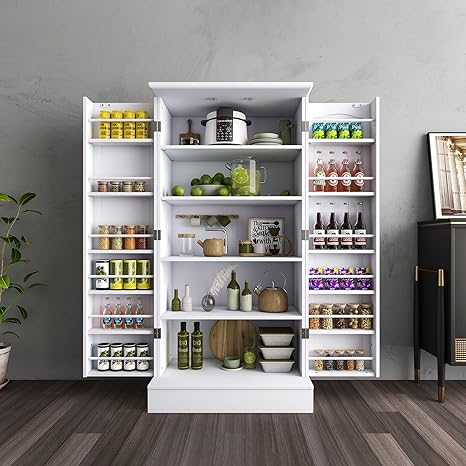
Find the location of a particular element. The image size is (466, 466). visible green fruits in shelf below top shelf in middle of cabinet is located at coordinates (176, 190), (194, 190), (220, 190), (195, 181), (206, 178), (212, 182), (218, 176), (226, 182).